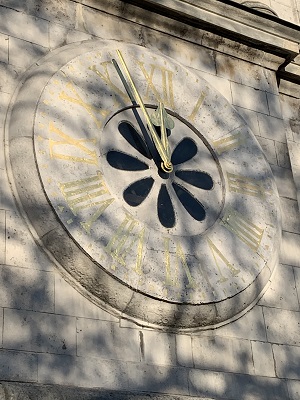
Locate an element on the screen. clock is located at coordinates (56, 165).